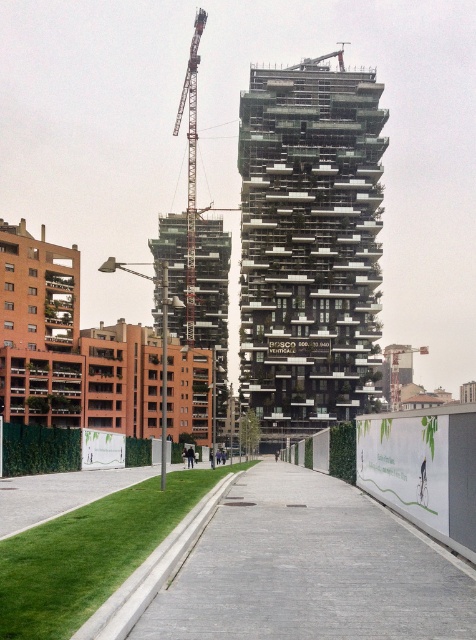
What are the coordinates of `green grass at lower left` in the screenshot? It's located at (89, 554).

Can you confirm if green grass at lower left is shorter than metallic gray crane at upper center?

Correct, green grass at lower left is not as tall as metallic gray crane at upper center.

Does point (35, 556) lie in front of point (190, 134)?

Yes, point (35, 556) is closer to viewer.

Locate an element on the screen. This screenshot has width=476, height=640. green grass at lower left is located at coordinates (89, 554).

Is green grass at lower left to the right of glassy concrete tower at center from the viewer's perspective?

Yes, green grass at lower left is to the right of glassy concrete tower at center.

Who is more distant from viewer, (89, 560) or (185, 300)?

Positioned behind is point (185, 300).

Locate an element on the screen. green grass at lower left is located at coordinates (89, 554).

Based on the photo, who is positioned more to the right, glassy concrete tower at center or metallic gray crane at upper center?

glassy concrete tower at center is more to the right.

In order to click on glassy concrete tower at center in this screenshot , I will do `click(212, 301)`.